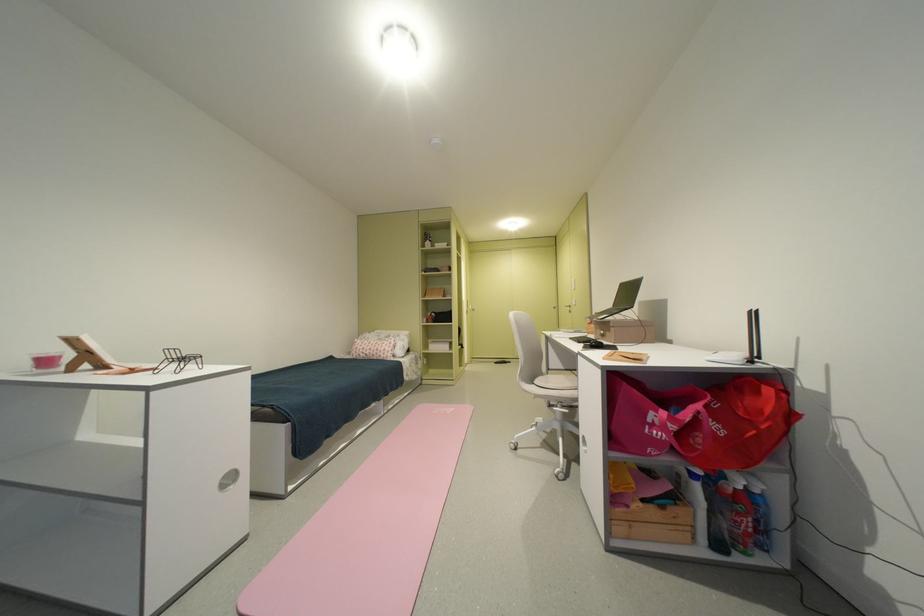
The width and height of the screenshot is (924, 616). Describe the element at coordinates (556, 381) in the screenshot. I see `the chair sitting surface` at that location.